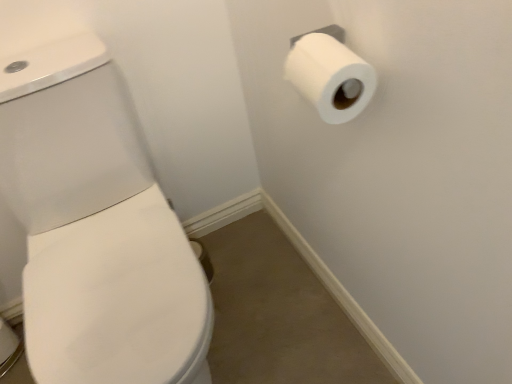
Question: Should I look upward or downward to see white matte toilet paper at upper right?

Choices:
 (A) up
 (B) down

Answer: (A)